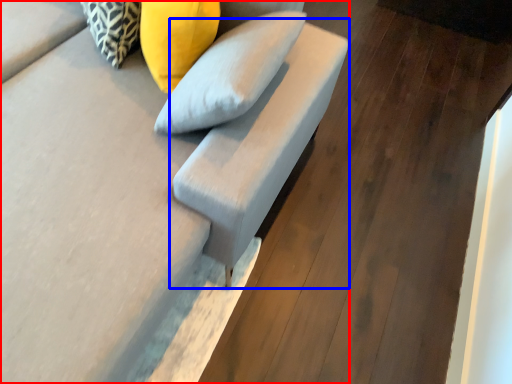
Question: Which point is closer to the camera, furniture (highlighted by a red box) or armchair (highlighted by a blue box)?

Choices:
 (A) furniture
 (B) armchair

Answer: (A)